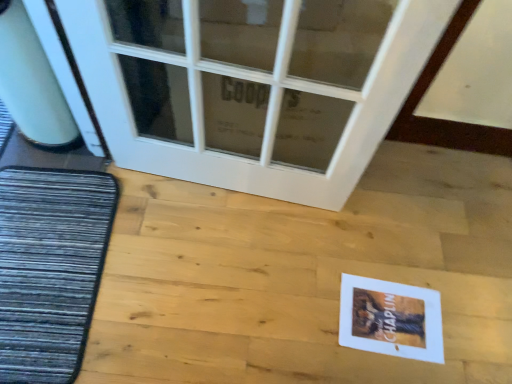
Question: Which is correct: dark gray textured mat at left is inside white paper postcard at lower right, or outside of it?

Choices:
 (A) outside
 (B) inside

Answer: (A)

Question: From the image's perspective, is dark gray textured mat at left located above or below white paper postcard at lower right?

Choices:
 (A) above
 (B) below

Answer: (A)

Question: Based on their relative distances, which object is nearer to the white glass door at upper center?

Choices:
 (A) dark gray textured mat at left
 (B) white paper postcard at lower right

Answer: (A)

Question: Which of these objects is positioned closest to the dark gray textured mat at left?

Choices:
 (A) white glass door at upper center
 (B) white paper postcard at lower right

Answer: (A)